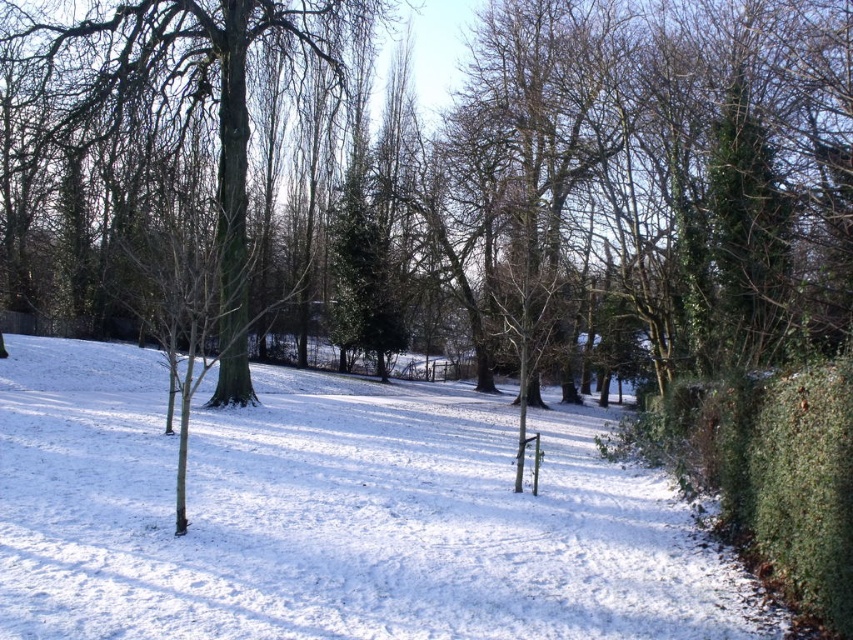
Does white powdery snow at center have a greater height compared to green leafy hedge at right?

Indeed, white powdery snow at center has a greater height compared to green leafy hedge at right.

Can you confirm if white powdery snow at center is thinner than green leafy hedge at right?

No.

Is point (263, 433) in front of point (817, 368)?

That is False.

Locate an element on the screen. Image resolution: width=853 pixels, height=640 pixels. white powdery snow at center is located at coordinates (329, 515).

Is green leafy hedge at right positioned behind green matte tree at center?

That is False.

Is green leafy hedge at right smaller than green matte tree at center?

Yes.

Is point (839, 436) farther from camera compared to point (202, 29)?

No, (839, 436) is closer to viewer.

You are a GUI agent. You are given a task and a screenshot of the screen. Output one action in this format:
    pyautogui.click(x=<x>, y=<y>)
    Task: Click on the green leafy hedge at right
    
    Given the screenshot: What is the action you would take?
    pyautogui.click(x=766, y=474)

Can you confirm if white powdery snow at center is positioned to the right of green matte tree at center?

Indeed, white powdery snow at center is positioned on the right side of green matte tree at center.

This screenshot has height=640, width=853. What do you see at coordinates (329, 515) in the screenshot?
I see `white powdery snow at center` at bounding box center [329, 515].

This screenshot has height=640, width=853. I want to click on white powdery snow at center, so click(329, 515).